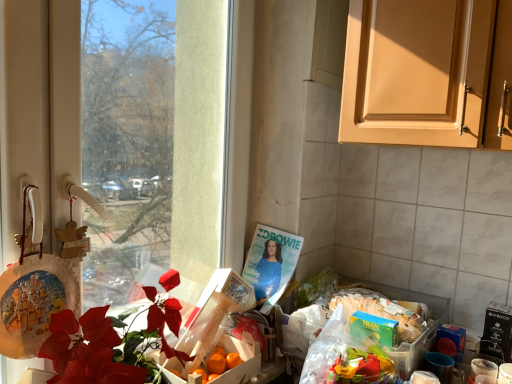
Question: Choose the correct answer: Is transparent glass window at left inside green matte box of tran rice at lower right or outside it?

Choices:
 (A) inside
 (B) outside

Answer: (B)

Question: Looking at the image, does transparent glass window at left seem bigger or smaller compared to green matte box of tran rice at lower right?

Choices:
 (A) big
 (B) small

Answer: (A)

Question: Which object is the closest to the matte paper magazine at center?

Choices:
 (A) white glossy coffee cup at lower right
 (B) orange matte box at center, the 2th box when ordered from top to bottom
 (C) wooden crate of oranges at center, which ranks as the 2th box in bottom-to-top order
 (D) green matte box of tran rice at lower right
 (E) transparent glass window at left

Answer: (C)

Question: Estimate the real-world distances between objects in this image. Which object is farther from the green matte box of tran rice at lower right?

Choices:
 (A) wooden crate of oranges at center, which ranks as the 2th box in bottom-to-top order
 (B) matte paper magazine at center
 (C) white glossy coffee cup at lower right
 (D) orange matte box at center, positioned as the first box in bottom-to-top order
 (E) transparent glass window at left

Answer: (E)